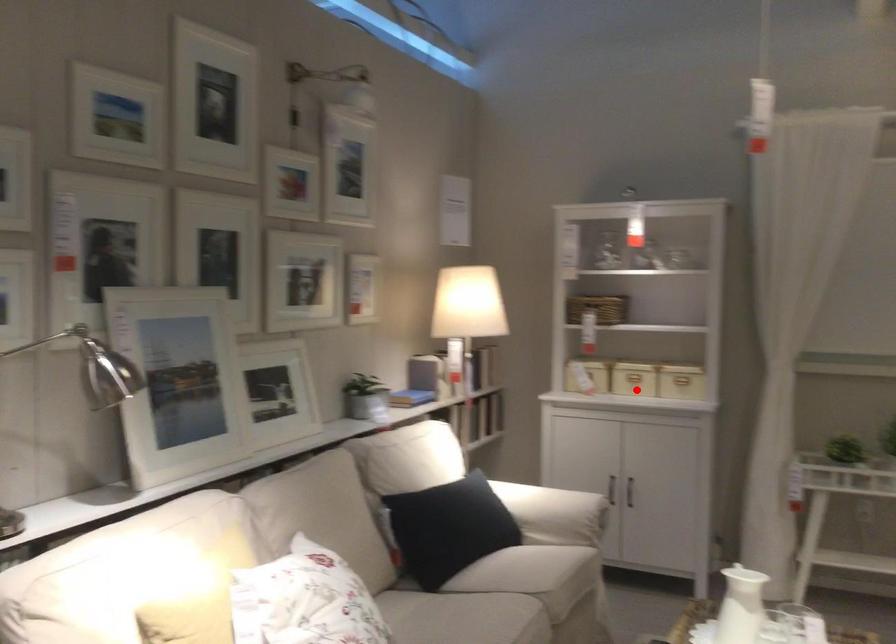
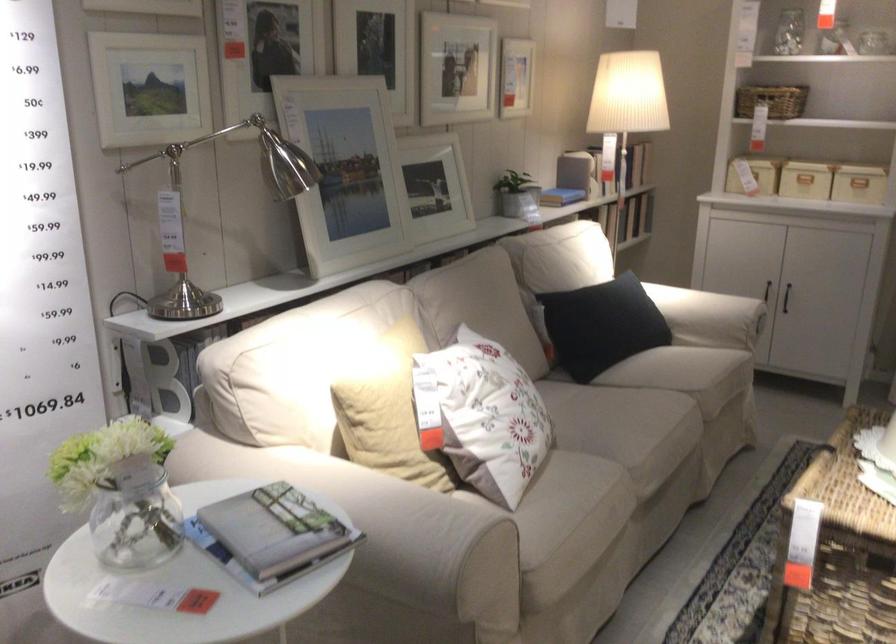
Question: A red point is marked in image1. In image2, is the corresponding 3D point closer to the camera or farther? Reply with the corresponding letter.

Choices:
 (A) The corresponding 3D point is closer.
 (B) The corresponding 3D point is farther.

Answer: (A)